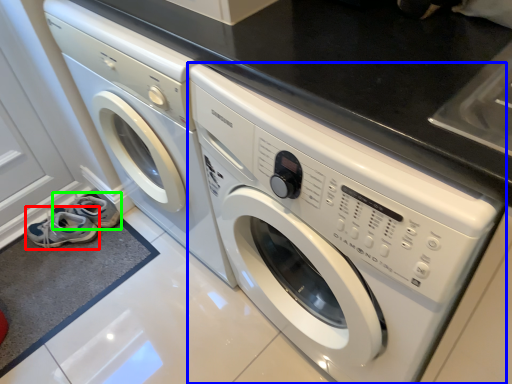
Question: Estimate the real-world distances between objects in this image. Which object is closer to shoe (highlighted by a red box), washing machine (highlighted by a blue box) or shoe (highlighted by a green box)?

Choices:
 (A) washing machine
 (B) shoe

Answer: (B)